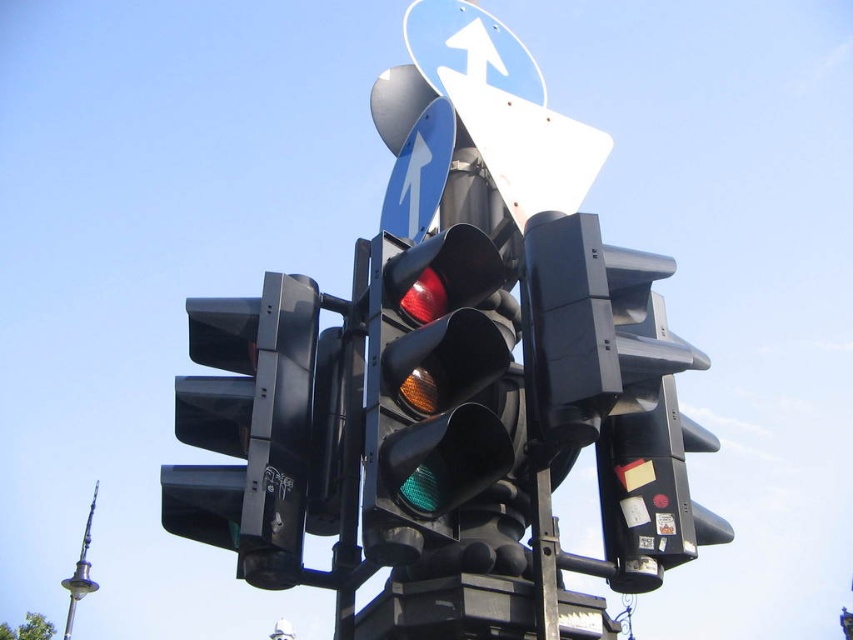
Does black plastic traffic light at center have a greater width compared to white plastic traffic sign at upper center?

Incorrect, black plastic traffic light at center's width does not surpass white plastic traffic sign at upper center's.

Which of these two, black plastic traffic light at center or white plastic traffic sign at upper center, stands taller?

Standing taller between the two is white plastic traffic sign at upper center.

The image size is (853, 640). I want to click on black plastic traffic light at center, so click(x=248, y=428).

Locate an element on the screen. The image size is (853, 640). white plastic traffic sign at upper center is located at coordinates (503, 108).

Which is behind, point (538, 180) or point (71, 600)?

Positioned behind is point (71, 600).

Between point (541, 77) and point (90, 529), which one is positioned in front?

Point (541, 77)

Where is `white plastic traffic sign at upper center`? The height and width of the screenshot is (640, 853). white plastic traffic sign at upper center is located at coordinates (503, 108).

Does black plastic traffic light at center appear on the right side of blue glossy sign at upper center?

No, black plastic traffic light at center is not to the right of blue glossy sign at upper center.

Does black plastic traffic light at center have a larger size compared to blue glossy sign at upper center?

Yes, black plastic traffic light at center is bigger than blue glossy sign at upper center.

Based on the photo, who is more forward, (172,518) or (416,220)?

Positioned in front is point (172,518).

Locate an element on the screen. black plastic traffic light at center is located at coordinates (248, 428).